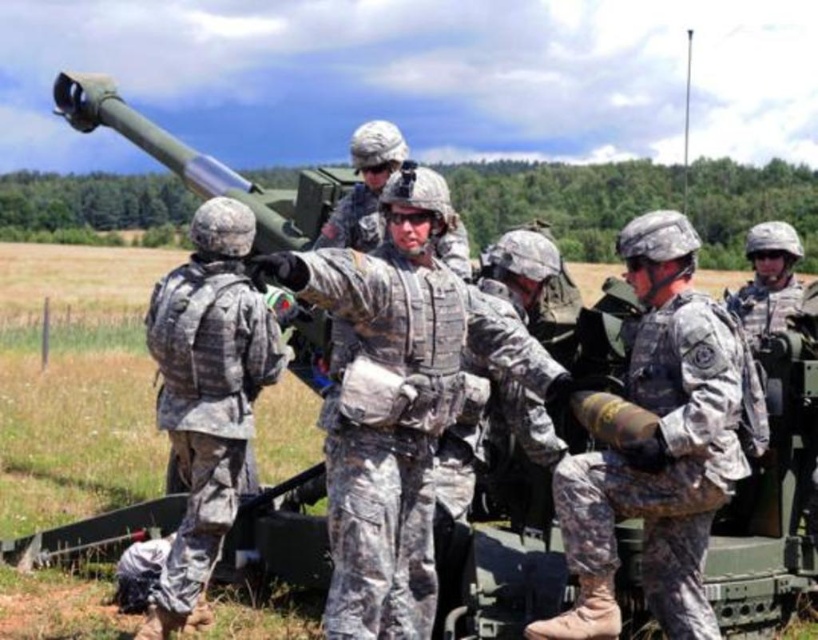
Locate an element on the screen. The width and height of the screenshot is (818, 640). camouflage uniform at center is located at coordinates (398, 400).

Between point (438, 365) and point (196, 618), which one is positioned behind?

Point (196, 618)

Between point (409, 506) and point (196, 608), which one is positioned in front?

Point (409, 506) is in front.

Find the location of a particular element. Image resolution: width=818 pixels, height=640 pixels. camouflage uniform at center is located at coordinates (398, 400).

Who is positioned more to the left, camouflage uniform at center or camouflage fabric bomb at center?

camouflage uniform at center

Identify the location of camouflage uniform at center. This screenshot has width=818, height=640. (398, 400).

Does camouflage fabric bomb at center have a smaller size compared to camouflage fabric uniform at center?

No.

Is camouflage fabric bomb at center behind camouflage fabric uniform at center?

No, camouflage fabric bomb at center is closer to the viewer.

Which is in front, point (677, 428) or point (173, 435)?

Point (677, 428) is in front.

Identify the location of camouflage fabric bomb at center. (661, 445).